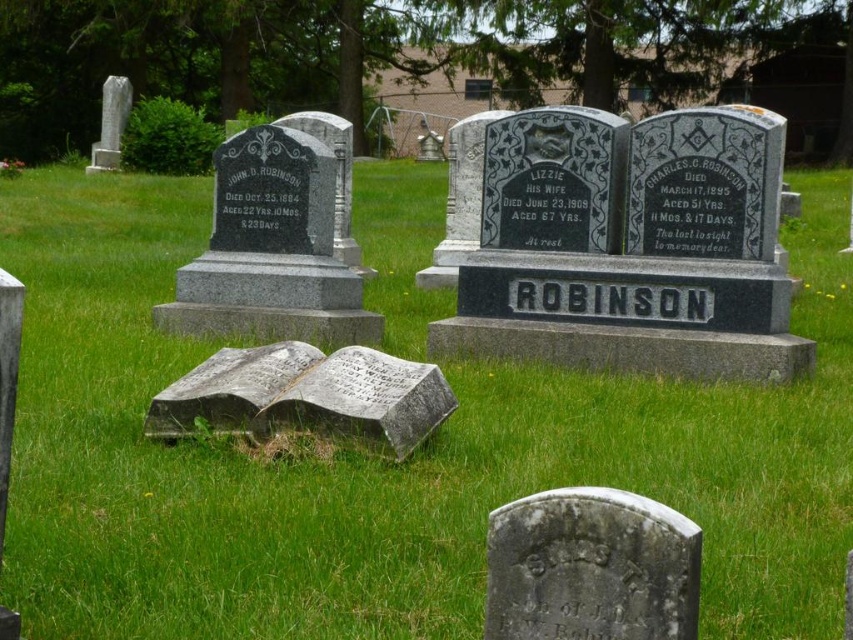
You are a groundskeeper in the cemetery and need to place a new gray stone book at center. The current gray stone gravestone at lower center is in the way. Can you move the gravestone to the side to make space for the book?

The gray stone gravestone at lower center has a lesser width compared to the gray stone book at center, so moving the gravestone might be necessary to accommodate the wider book.

You are standing at the entrance of the cemetery and see two points marked in the image. The first point is at coordinates point (543,493) and the second point is at point (219,392). Which point is closer to your current position?

Point (543,493) is in front of point (219,392), so it is closer to your current position at the entrance.